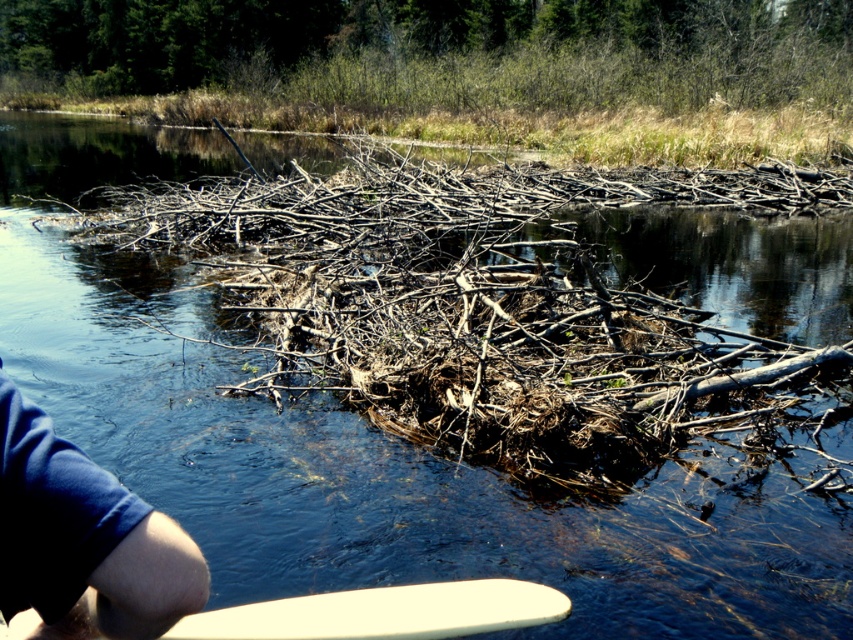
You are standing at the edge of the water in the scene and see the point labeled as point (84,538). What object is located at that point?

The point (84,538) indicates the blue fabric arm at lower left.

You are standing at the edge of the water and see the blue fabric arm at lower left and the white smooth surfboard at lower center. Which object is closer to your left side?

The blue fabric arm at lower left is closer to your left side because it is positioned to the left of the white smooth surfboard at lower center.

You are standing on the riverbank and want to place both the blue fabric arm at lower left and the white smooth surfboard at lower center onto a 1.2 meter wide floating platform. Can both items fit side by side without overlapping?

The blue fabric arm at lower left is narrower than the white smooth surfboard at lower center. However, since the surfboard is wider than the platform, placing them side by side would exceed the platform width. Therefore, they cannot fit without overlapping.